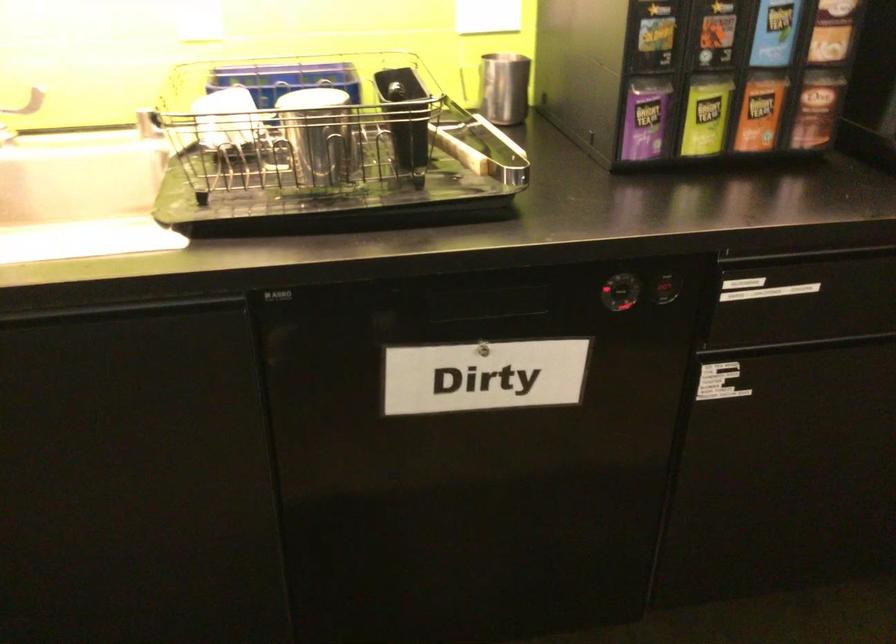
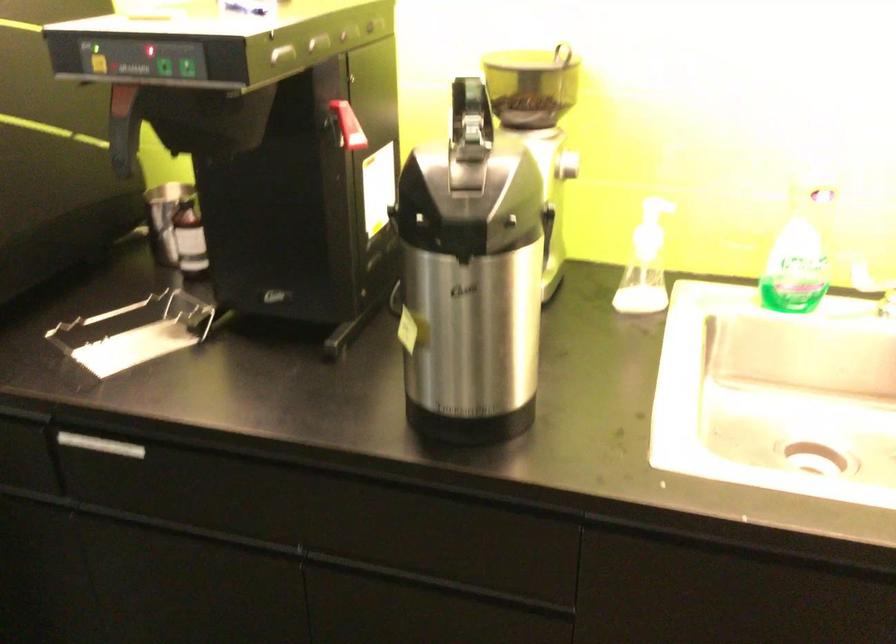
Question: How did the camera likely rotate?

Choices:
 (A) Left
 (B) Right
 (C) Up
 (D) Down

Answer: (A)